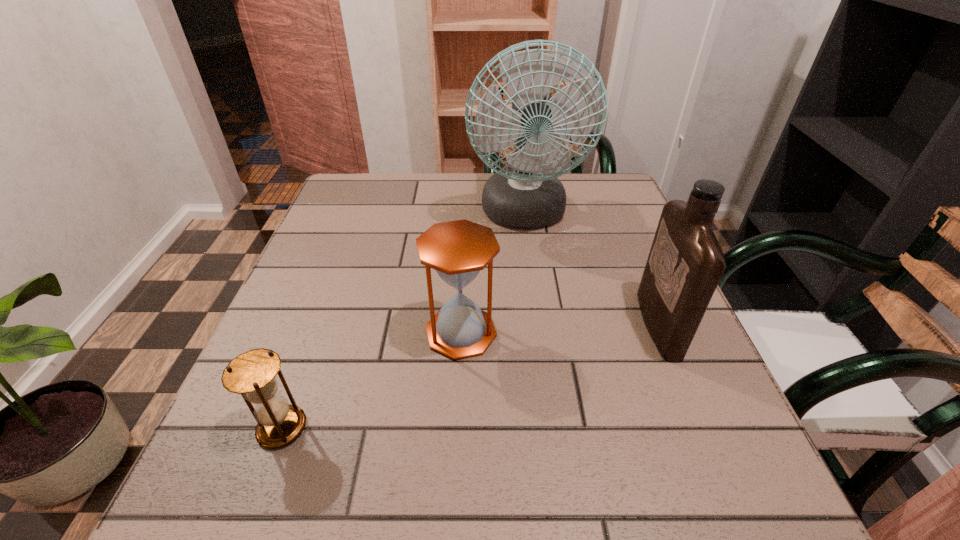
At what (x,y) coordinates should I click in order to perform the action: click on the farthest object. Please return your answer as a coordinate pair (x, y). Image resolution: width=960 pixels, height=540 pixels. Looking at the image, I should click on (527, 196).

This screenshot has width=960, height=540. I want to click on fan, so click(527, 196).

Find the location of `the third shortest object`. the third shortest object is located at coordinates (685, 264).

The image size is (960, 540). I want to click on liquor, so click(685, 264).

Find the location of a particular element. the farther hourglass is located at coordinates (458, 250).

Where is `the second shortest object`? Image resolution: width=960 pixels, height=540 pixels. the second shortest object is located at coordinates (458, 250).

In order to click on the leftmost object in this screenshot , I will do `click(252, 374)`.

At what (x,y) coordinates should I click in order to perform the action: click on the nearer hourglass. Please return your answer as a coordinate pair (x, y). Looking at the image, I should click on tap(252, 374).

Where is `free spot located 0.090m in front of the fan where the airflow is directed`? This screenshot has height=540, width=960. free spot located 0.090m in front of the fan where the airflow is directed is located at coordinates (532, 273).

Identify the location of vacant area located 0.100m on the label side of the liquor. Image resolution: width=960 pixels, height=540 pixels. (592, 324).